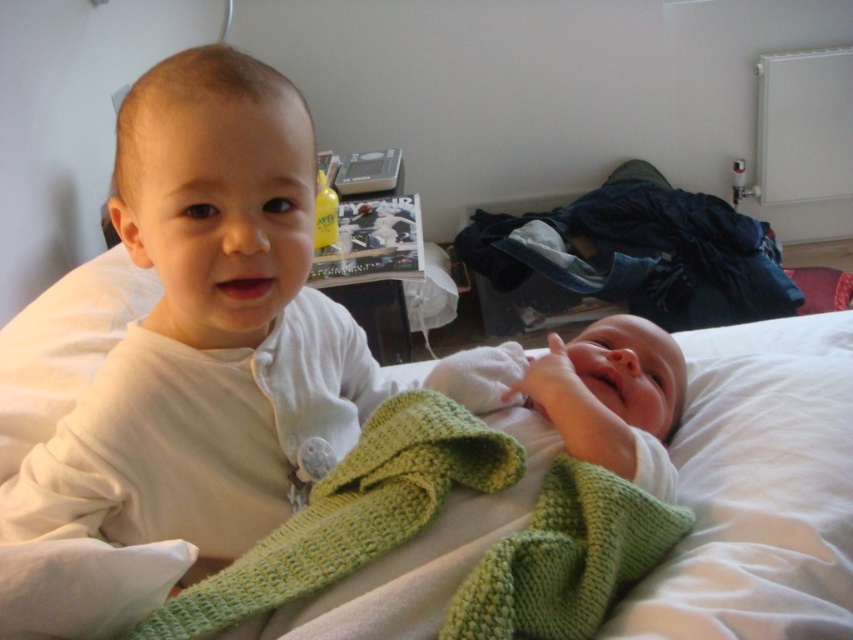
You are a photographer trying to capture a closeup of the white matte baby at upper left. Based on the coordinates provided, where exactly should you focus your camera lens?

The white matte baby at upper left is located at coordinates point (206, 326), so focus your camera lens there to capture the closeup.